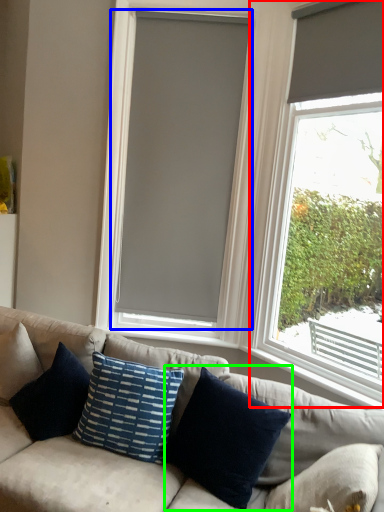
Question: Which object is the closest to the window (highlighted by a red box)? Choose among these: window blind (highlighted by a blue box) or pillow (highlighted by a green box).

Choices:
 (A) window blind
 (B) pillow

Answer: (A)